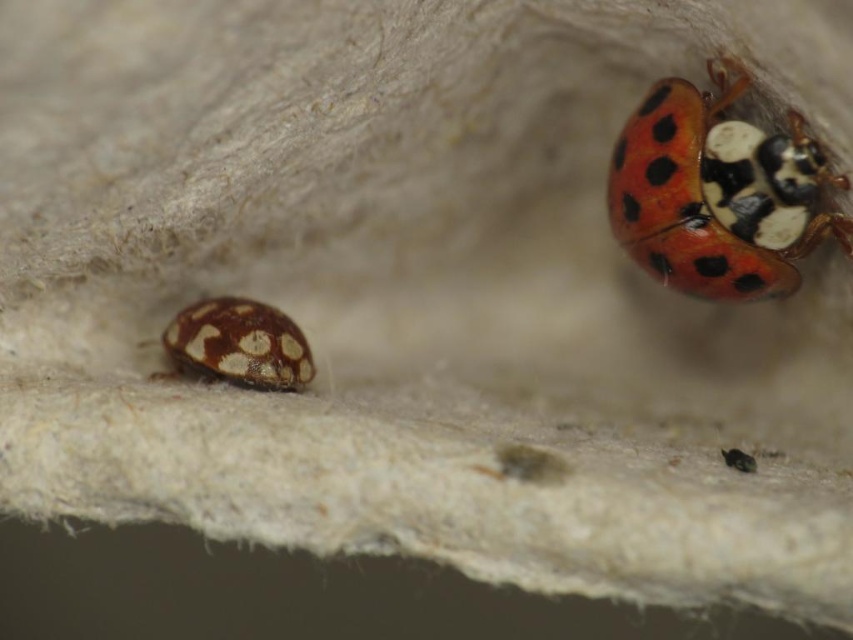
This screenshot has height=640, width=853. Describe the element at coordinates (718, 193) in the screenshot. I see `shiny red beetle at upper right` at that location.

Between point (769, 282) and point (729, 451), which one is positioned behind?

The point (769, 282) is more distant.

This screenshot has height=640, width=853. I want to click on shiny red beetle at upper right, so click(x=718, y=193).

Identify the location of shiny red beetle at upper right. Image resolution: width=853 pixels, height=640 pixels. (718, 193).

Is matte brown ladybug at lower left to the left of shiny metallic bug at upper right from the viewer's perspective?

Indeed, matte brown ladybug at lower left is positioned on the left side of shiny metallic bug at upper right.

How much distance is there between matte brown ladybug at lower left and shiny metallic bug at upper right?

matte brown ladybug at lower left and shiny metallic bug at upper right are 24.73 inches apart from each other.

Describe the element at coordinates (236, 344) in the screenshot. This screenshot has height=640, width=853. I see `matte brown ladybug at lower left` at that location.

At what (x,y) coordinates should I click in order to perform the action: click on matte brown ladybug at lower left. Please return your answer as a coordinate pair (x, y). Image resolution: width=853 pixels, height=640 pixels. Looking at the image, I should click on (236, 344).

Who is more distant from viewer, (x=721, y=72) or (x=276, y=310)?

The point (x=276, y=310) is behind.

Is shiny red beetle at upper right to the left of matte brown ladybug at lower left from the viewer's perspective?

In fact, shiny red beetle at upper right is to the right of matte brown ladybug at lower left.

Where is `shiny red beetle at upper right`? The image size is (853, 640). shiny red beetle at upper right is located at coordinates (718, 193).

Locate an element on the screen. The image size is (853, 640). shiny red beetle at upper right is located at coordinates (718, 193).